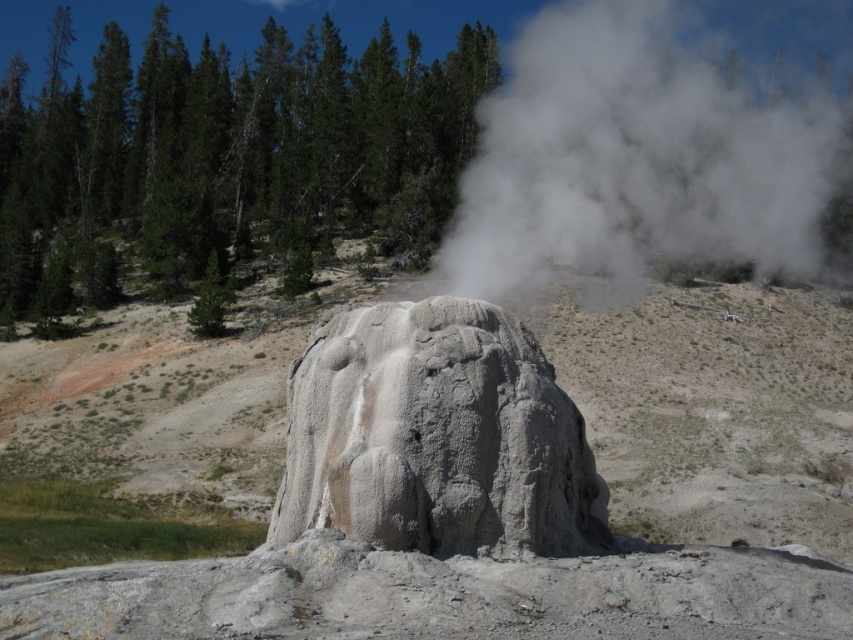
Which is in front, point (225, 394) or point (537, 257)?

Positioned in front is point (537, 257).

Is point (223, 541) positioned in front of point (604, 208)?

No.

The image size is (853, 640). In order to click on gray rock formation at center in this screenshot , I will do `click(712, 408)`.

In the scene shown: Who is taller, white vapor at center or gray rough rock at center?

Standing taller between the two is white vapor at center.

Find the location of `white vapor at center`. white vapor at center is located at coordinates (633, 161).

Which is behind, point (653, 84) or point (560, 467)?

The point (653, 84) is behind.

At what (x,y) coordinates should I click in order to perform the action: click on white vapor at center. Please return your answer as a coordinate pair (x, y). Looking at the image, I should click on (633, 161).

Between gray rock formation at center and gray rough rock at center, which one is positioned lower?

gray rough rock at center

From the picture: Who is more forward, (260, 497) or (413, 337)?

Point (413, 337) is more forward.

Is point (805, 445) positioned in front of point (438, 428)?

No, (805, 445) is further to viewer.

The height and width of the screenshot is (640, 853). What are the coordinates of `gray rock formation at center` in the screenshot? It's located at coord(712,408).